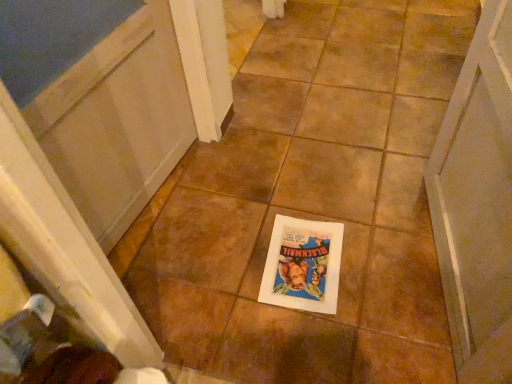
The width and height of the screenshot is (512, 384). I want to click on free location to the right of matte paper book at center, so click(379, 262).